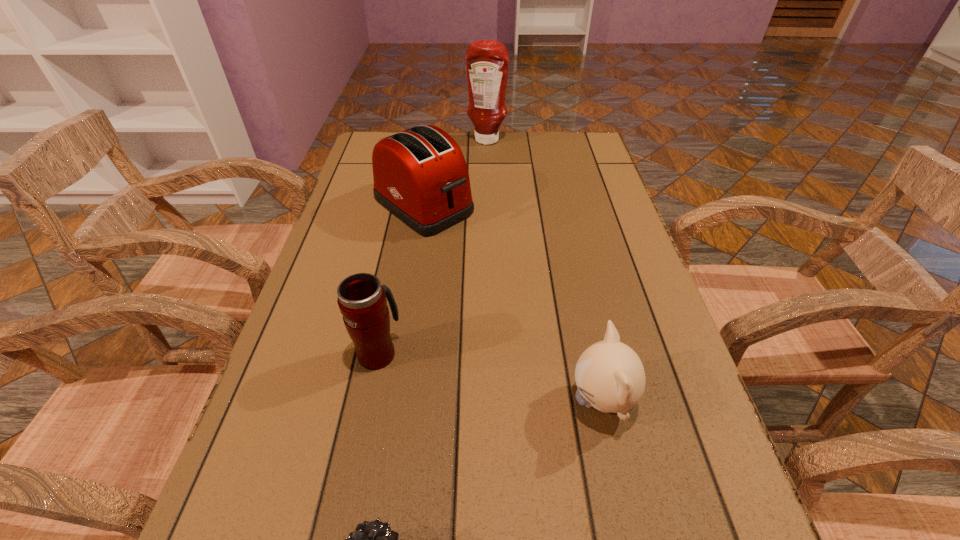
This screenshot has height=540, width=960. In the image, there is a desktop. Identify the location of vacant space at the right edge. (625, 245).

Identify the location of free region at the far left corner of the desktop. This screenshot has width=960, height=540. (368, 140).

This screenshot has width=960, height=540. What are the coordinates of `free region at the far right corner` in the screenshot? It's located at (578, 134).

What are the coordinates of `vacant area that lies between the thermos bottle and the farthest object` in the screenshot? It's located at (433, 247).

Find the location of `blank region between the farthest object and the thermos bottle`. blank region between the farthest object and the thermos bottle is located at coordinates (433, 247).

Image resolution: width=960 pixels, height=540 pixels. Find the location of `vacant point located between the condiment and the kitten`. vacant point located between the condiment and the kitten is located at coordinates (544, 271).

In order to click on vacant space that's between the farthest object and the kitten in this screenshot , I will do `click(544, 271)`.

Locate an element on the screen. free space that is in between the toaster and the thermos bottle is located at coordinates (401, 279).

The width and height of the screenshot is (960, 540). I want to click on the closest object relative to the toaster, so click(x=487, y=61).

Identify the location of object that is the second closest to the nearest object. Image resolution: width=960 pixels, height=540 pixels. (610, 377).